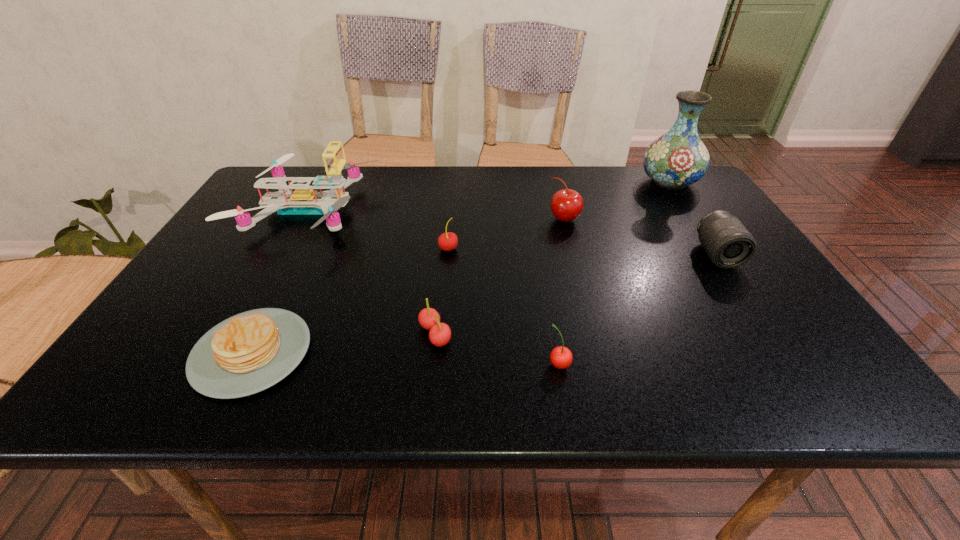
Where is `vacant space that satisfies the following two spatial constraints: 1. on the front-facing side of the second tallest object; 2. on the back side of the nearest cherry`? Image resolution: width=960 pixels, height=540 pixels. vacant space that satisfies the following two spatial constraints: 1. on the front-facing side of the second tallest object; 2. on the back side of the nearest cherry is located at coordinates (225, 364).

Locate an element on the screen. blank area in the image that satisfies the following two spatial constraints: 1. on the front-facing side of the third nearest cherry; 2. on the right side of the drone is located at coordinates (287, 248).

Where is `free space that satisfies the following two spatial constraints: 1. on the front-facing side of the seventh shortest object; 2. on the right side of the second nearest cherry`? The height and width of the screenshot is (540, 960). free space that satisfies the following two spatial constraints: 1. on the front-facing side of the seventh shortest object; 2. on the right side of the second nearest cherry is located at coordinates (241, 335).

This screenshot has width=960, height=540. Find the location of `free space that satisfies the following two spatial constraints: 1. on the back side of the sixth object from left to right; 2. on the left side of the third nearest cherry`. free space that satisfies the following two spatial constraints: 1. on the back side of the sixth object from left to right; 2. on the left side of the third nearest cherry is located at coordinates (451, 219).

Identify the location of free location that satisfies the following two spatial constraints: 1. on the back side of the pancake; 2. on the front-facing side of the drone. (323, 210).

Image resolution: width=960 pixels, height=540 pixels. Identify the location of free location that satisfies the following two spatial constraints: 1. on the back side of the third nearest cherry; 2. on the left side of the pancake. (x=303, y=248).

Find the location of a particular element. This screenshot has height=540, width=960. blank area in the image that satisfies the following two spatial constraints: 1. on the front-facing side of the third nearest cherry; 2. on the right side of the second tallest object is located at coordinates (287, 248).